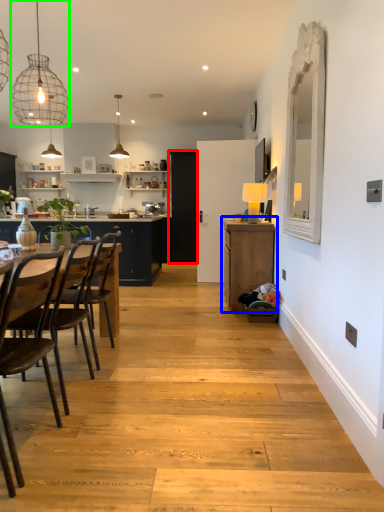
Question: Estimate the real-world distances between objects in this image. Which object is closer to glass door (highlighted by a red box), cabinetry (highlighted by a blue box) or light fixture (highlighted by a green box)?

Choices:
 (A) cabinetry
 (B) light fixture

Answer: (B)